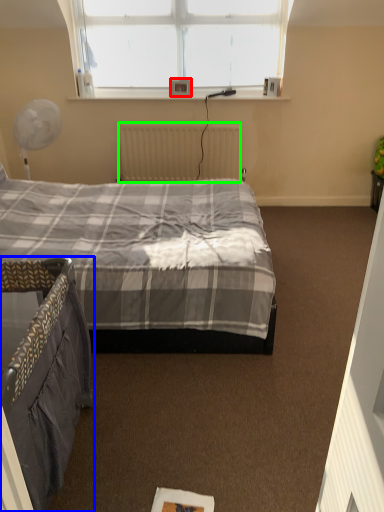
Question: Which is nearer to the picture frame (highlighted by a red box)? bed (highlighted by a blue box) or radiator (highlighted by a green box).

Choices:
 (A) bed
 (B) radiator

Answer: (B)